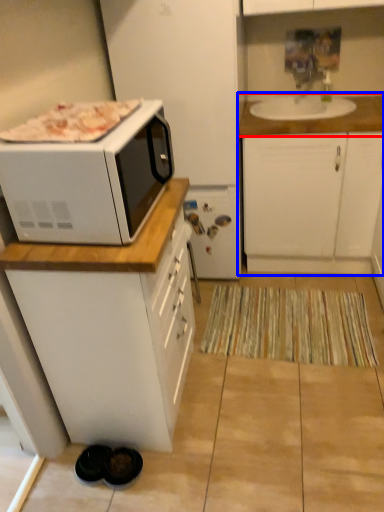
Question: Which of the following is the farthest to the observer, countertop (highlighted by a red box) or cabinetry (highlighted by a blue box)?

Choices:
 (A) countertop
 (B) cabinetry

Answer: (A)